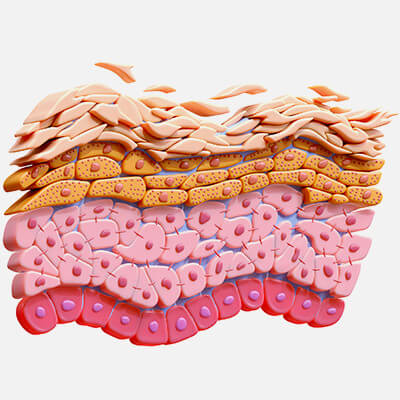
The width and height of the screenshot is (400, 400). What are the coordinates of `organ` in the screenshot? It's located at (253, 123).